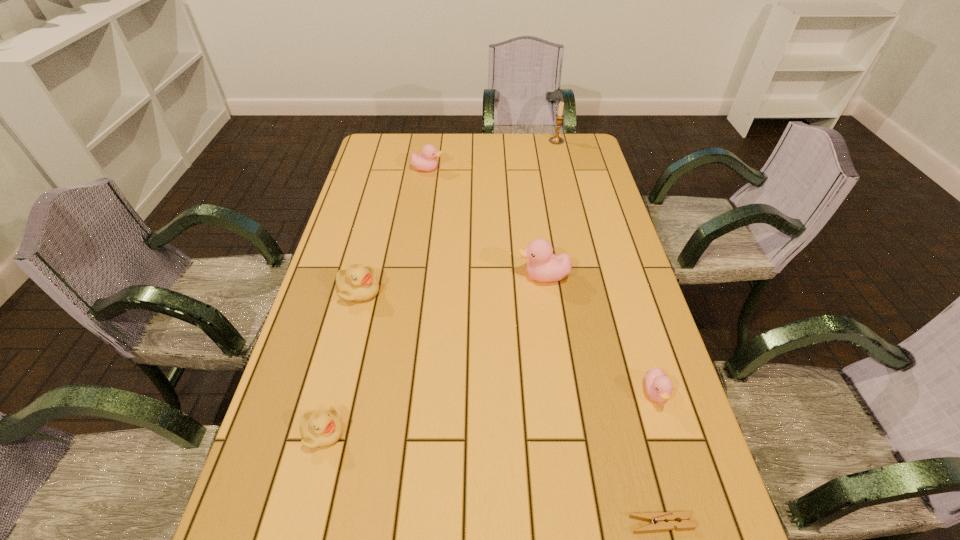
Where is `the smaller yellow duckling`? This screenshot has width=960, height=540. the smaller yellow duckling is located at coordinates (320, 428).

I want to click on the nearest object, so click(659, 518).

Image resolution: width=960 pixels, height=540 pixels. I want to click on the shortest object, so click(x=659, y=518).

Identify the location of free spot located on the front of the candle holder. The height and width of the screenshot is (540, 960). (564, 176).

At what (x,y) coordinates should I click in order to perform the action: click on free space located on the front-facing side of the second tallest object. Please return your answer as a coordinate pair (x, y). The height and width of the screenshot is (540, 960). Looking at the image, I should click on (434, 276).

The image size is (960, 540). I want to click on vacant space located on the front-facing side of the second tallest object, so click(406, 276).

This screenshot has width=960, height=540. In order to click on free location located on the front-facing side of the second tallest object in this screenshot , I will do `click(482, 276)`.

This screenshot has height=540, width=960. I want to click on free region located 0.310m on the front-facing side of the fifth object from right to left, so click(526, 169).

Image resolution: width=960 pixels, height=540 pixels. In order to click on vacant space located on the beak of the farther yellow duckling in this screenshot , I will do `click(499, 291)`.

Identify the location of free spot located 0.140m on the front-facing side of the second nearest duckling. This screenshot has height=540, width=960. (682, 477).